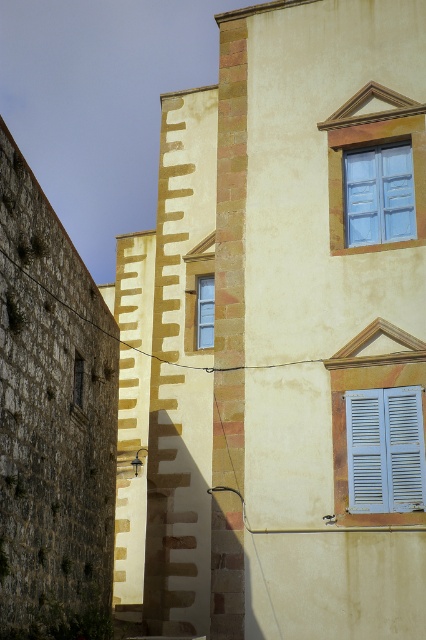
Question: Which point is farther from the camera taking this photo?

Choices:
 (A) (80, 380)
 (B) (210, 336)
 (C) (368, 230)

Answer: (B)

Question: Does white painted wood shutters at right lie behind dark brown wooden window at left?

Choices:
 (A) yes
 (B) no

Answer: (B)

Question: Can you confirm if white painted wood shutters at right is wider than blue painted wood window at upper right?

Choices:
 (A) yes
 (B) no

Answer: (B)

Question: Based on their relative distances, which object is farther from the white painted wood shutters at right?

Choices:
 (A) dark brown wooden window at left
 (B) blue painted wood window at upper right

Answer: (A)

Question: Among these points, which one is nearest to the camera?

Choices:
 (A) (419, 410)
 (B) (206, 301)
 (C) (357, 177)
 (D) (77, 401)

Answer: (A)

Question: Observing the image, what is the correct spatial positioning of blue painted wood window at upper right in reference to dark brown wooden window at left?

Choices:
 (A) above
 (B) below

Answer: (A)